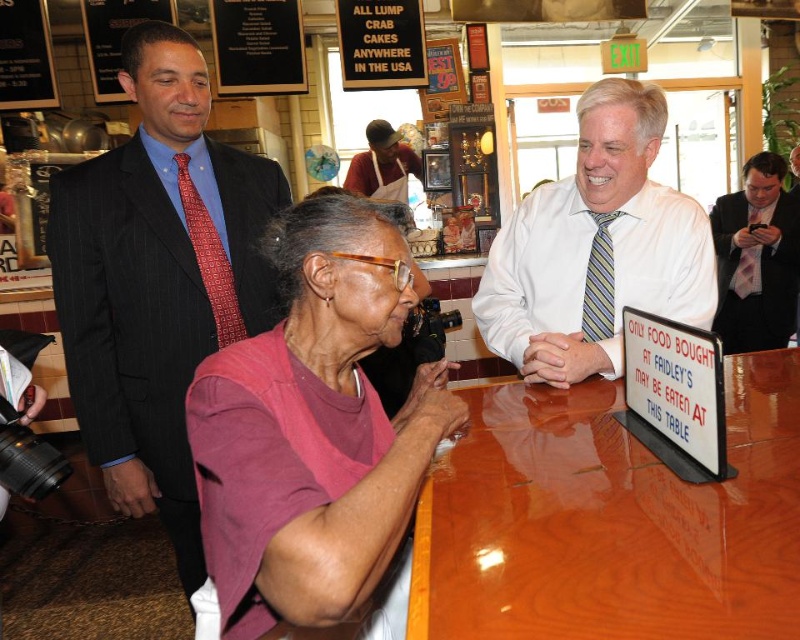
Who is higher up, pink fabric shirt at right or white apron at center?

white apron at center is higher up.

Does point (784, 269) come behind point (377, 168)?

No.

This screenshot has width=800, height=640. What are the coordinates of `pink fabric shirt at right` in the screenshot? It's located at (756, 259).

Is point (758, 438) positioned before point (237, 492)?

No, (758, 438) is further to viewer.

Which is behind, point (696, 486) or point (276, 369)?

The point (276, 369) is more distant.

Locate an element on the screen. The width and height of the screenshot is (800, 640). glossy wood table at center is located at coordinates (610, 520).

Which is in front, point (282, 365) or point (360, 192)?

Point (282, 365) is in front.

The image size is (800, 640). Describe the element at coordinates (314, 428) in the screenshot. I see `pink fabric shirt at center` at that location.

The image size is (800, 640). What are the coordinates of `pink fabric shirt at center` in the screenshot? It's located at (314, 428).